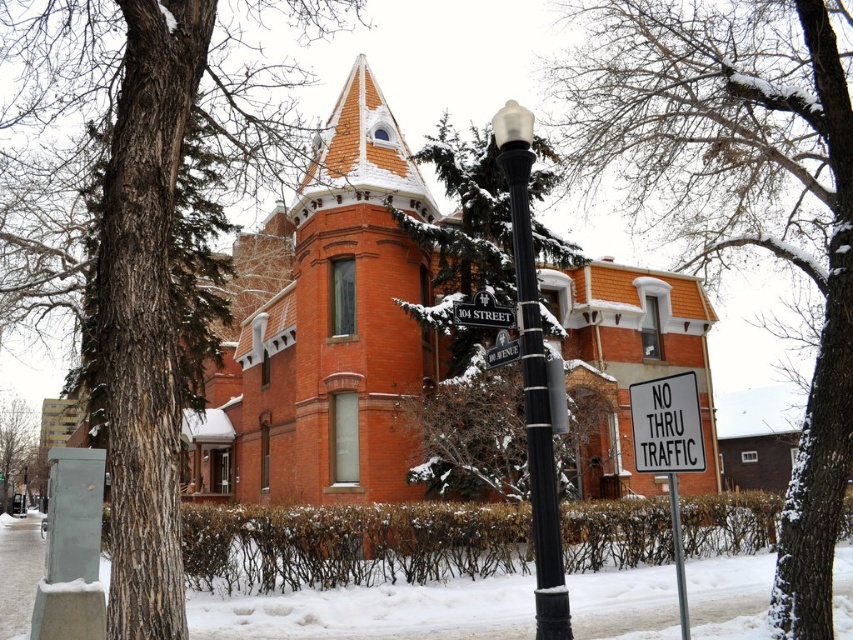
You are standing in front of the Victorian brick house and want to take a photo of the smooth bark tree at upper left. The camera you are using has a maximum focus range of 20 feet. Will you be able to capture the tree in focus without moving closer?

The smooth bark tree at upper left is 23.77 feet away from the camera, which exceeds the maximum focus range of 20 feet. Therefore, you will not be able to capture the tree in focus without moving closer.

You are standing on the sidewalk in front of the snow covered Victorian house. You see two points marked on the lamppost. One is at point (813, 566) and the other is at point (521, 140). Which point is closer to you?

Point (813, 566) is further to the viewer than point (521, 140), so the point at (521, 140) is closer to you.

You are standing at the entrance of the Victorian brick house and want to locate the black metal lamp post at center. According to the coordinates provided, where exactly would you find it?

The black metal lamp post at center is located at point 0.591 on the x axis and 0.626 on the y axis.